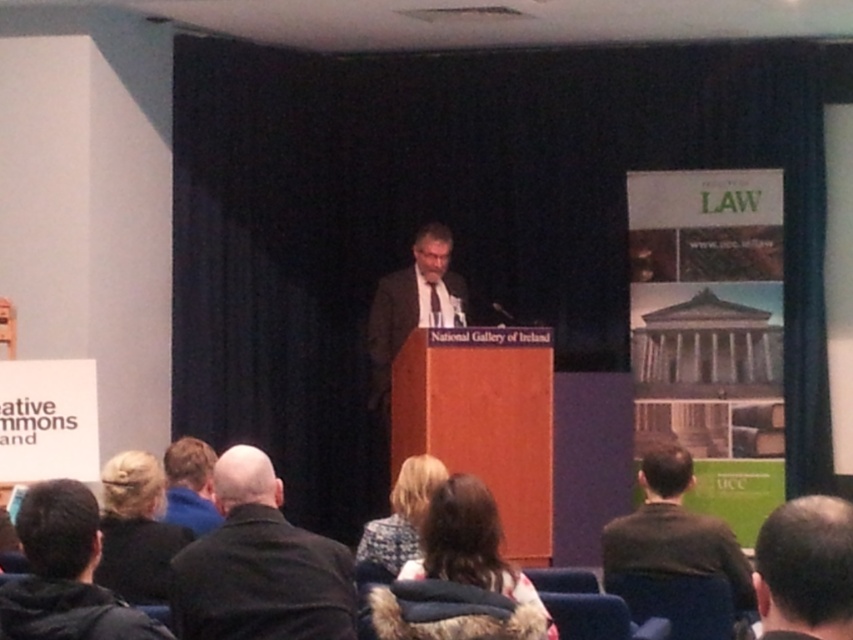
Question: Which of these objects is positioned closest to the dark brown hair at lower right?

Choices:
 (A) dark brown hair at lower center
 (B) blue fleece jacket at lower left
 (C) patterned fabric coat at lower center

Answer: (A)

Question: Can you confirm if blonde hair at lower left is positioned below patterned fabric coat at lower center?

Choices:
 (A) yes
 (B) no

Answer: (A)

Question: Does black leather jacket at lower center appear on the left side of blonde hair at lower left?

Choices:
 (A) no
 (B) yes

Answer: (A)

Question: Estimate the real-world distances between objects in this image. Which object is farther from the blonde hair at lower left?

Choices:
 (A) dark brown hair at lower center
 (B) black leather jacket at lower center

Answer: (A)

Question: Is dark brown hair at lower left bigger than blue fleece jacket at lower left?

Choices:
 (A) yes
 (B) no

Answer: (B)

Question: Which of the following is the farthest from the observer?

Choices:
 (A) blue fleece jacket at lower left
 (B) black leather jacket at lower center
 (C) dark brown hair at lower center
 (D) patterned fabric coat at lower center

Answer: (A)